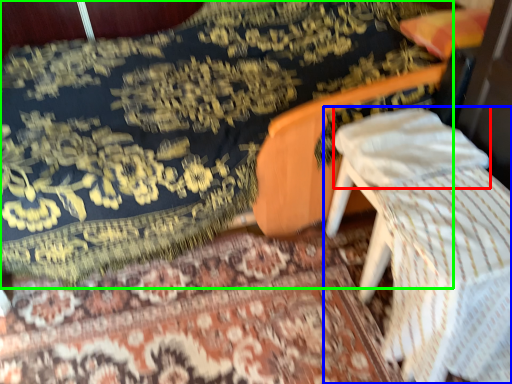
Question: Which is nearer to the pillow (highlighted by a red box)? furniture (highlighted by a blue box) or mattress (highlighted by a green box).

Choices:
 (A) furniture
 (B) mattress

Answer: (A)